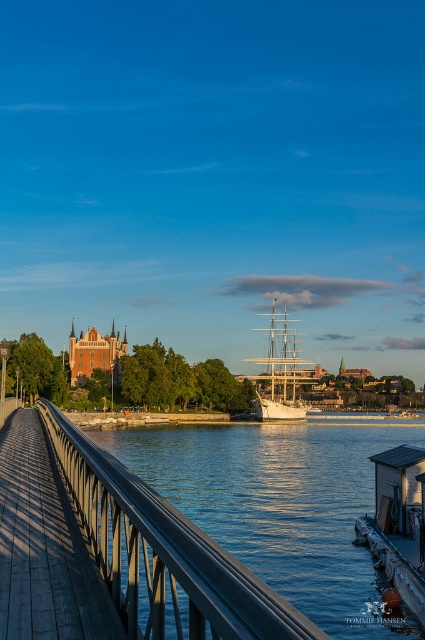
Question: Considering the relative positions of metallic gray rail at center and white wooden ship at center in the image provided, where is metallic gray rail at center located with respect to white wooden ship at center?

Choices:
 (A) above
 (B) below

Answer: (B)

Question: Among these points, which one is farthest from the camera?

Choices:
 (A) (268, 385)
 (B) (138, 627)

Answer: (A)

Question: Is metallic gray rail at center wider than wooden dock at left?

Choices:
 (A) yes
 (B) no

Answer: (A)

Question: Which of the following is the farthest from the observer?

Choices:
 (A) (189, 630)
 (B) (294, 388)
 (C) (76, 528)

Answer: (B)

Question: Which object is farther from the camera taking this photo?

Choices:
 (A) wooden dock at left
 (B) white wooden ship at center
 (C) metallic gray rail at center

Answer: (B)

Question: Does metallic gray rail at center appear over white wooden ship at center?

Choices:
 (A) yes
 (B) no

Answer: (B)